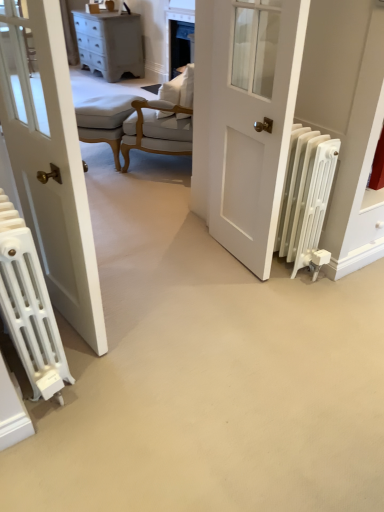
Question: Is point (160, 119) positioned closer to the camera than point (329, 178)?

Choices:
 (A) farther
 (B) closer

Answer: (A)

Question: Is white fabric chair at center wider or thinner than white matte radiator at right, which is the second radiator in left-to-right order?

Choices:
 (A) wide
 (B) thin

Answer: (A)

Question: Estimate the real-world distances between objects in this image. Which object is farther from the white fabric chair at center?

Choices:
 (A) light beige fabric stool at center
 (B) white matte door at center
 (C) matte white chest of drawers at upper left
 (D) white matte radiator at lower left, the second radiator viewed from the right
 (E) white matte radiator at right, placed as the 1th radiator when sorted from right to left

Answer: (C)

Question: Which object is positioned farthest from the white matte radiator at right, which is the second radiator in left-to-right order?

Choices:
 (A) matte white chest of drawers at upper left
 (B) light beige fabric stool at center
 (C) white fabric chair at center
 (D) white matte door at center
 (E) white matte radiator at lower left, acting as the first radiator starting from the left

Answer: (A)